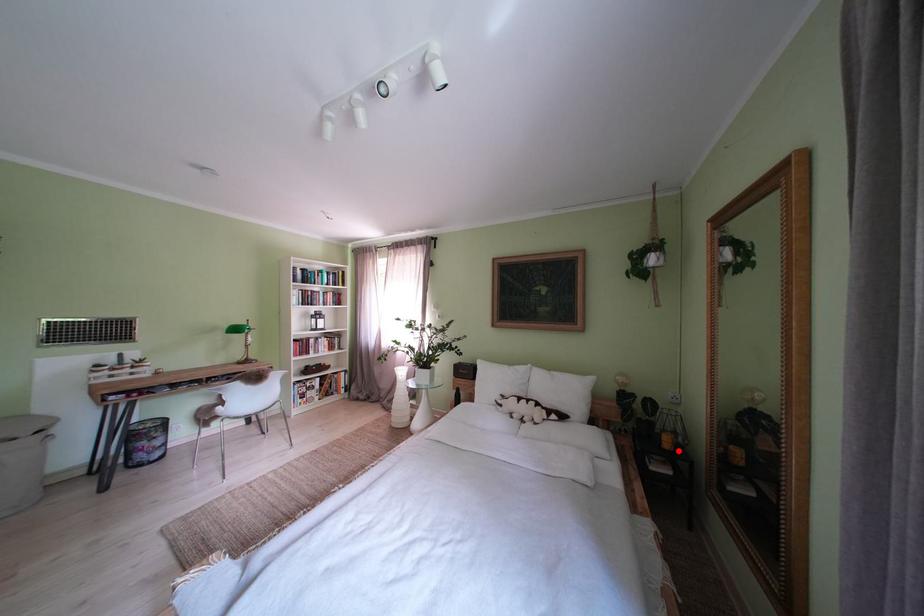
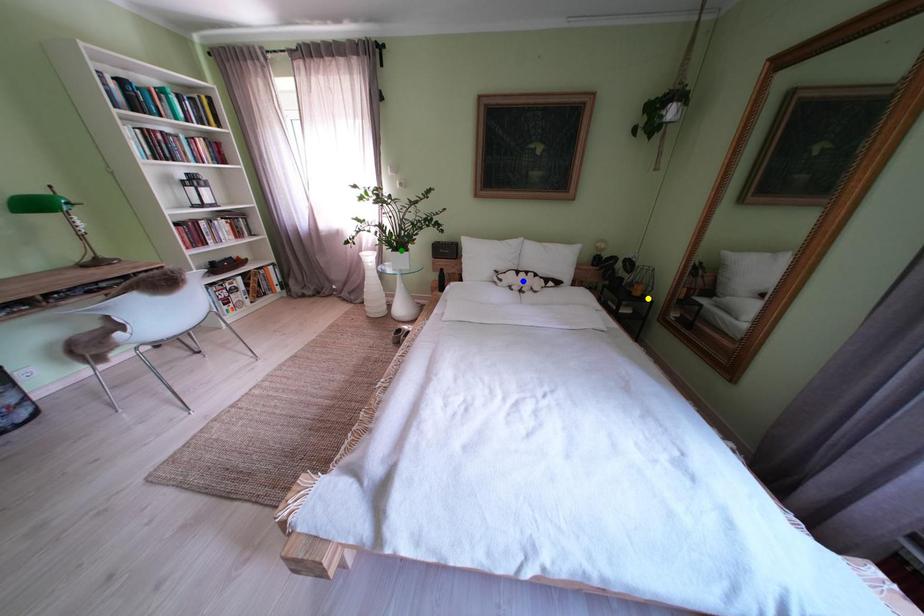
Question: I am providing you with two images of the same scene from different viewpoints. A red point is marked on the first image. You are given multiple points on the second image. In image 2, which mark is for the same physical point as the one in image 1?

Choices:
 (A) yellow point
 (B) blue point
 (C) green point

Answer: (A)